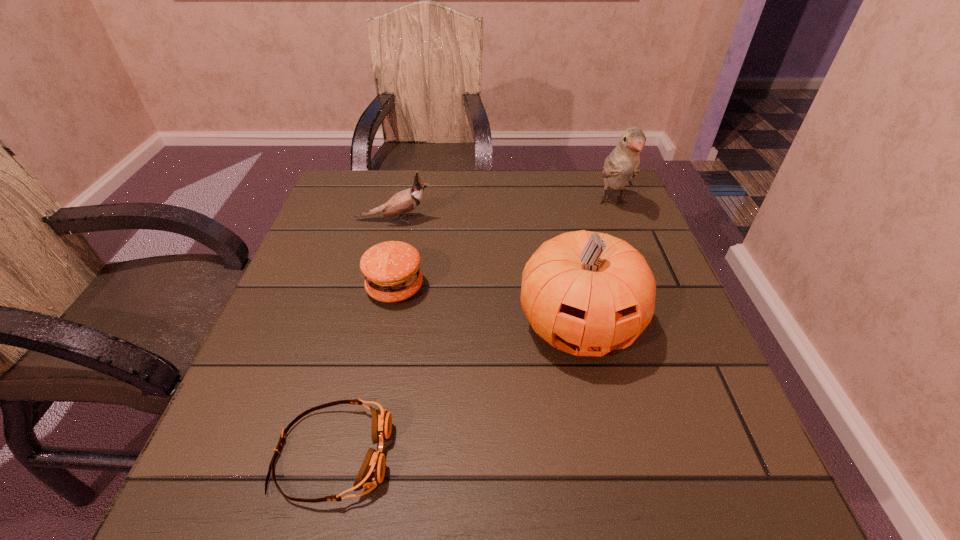
Image resolution: width=960 pixels, height=540 pixels. In order to click on vacant space that's between the fourth tallest object and the second object from right to left in this screenshot , I will do `click(487, 307)`.

Where is `vacant space in between the goggles and the rightmost object`? The height and width of the screenshot is (540, 960). vacant space in between the goggles and the rightmost object is located at coordinates click(x=472, y=328).

This screenshot has height=540, width=960. In order to click on vacant space that's between the rightmost object and the shortest object in this screenshot , I will do pyautogui.click(x=472, y=328).

Identify the location of object that is the second closest to the left bird. (586, 293).

Identify the location of object that stands as the third closest to the nearest object. (406, 201).

Find the location of a particular element. The height and width of the screenshot is (540, 960). vacant area in the image that satisfies the following two spatial constraints: 1. on the back side of the second shortest object; 2. at the face of the third tallest object is located at coordinates (409, 220).

You are a GUI agent. You are given a task and a screenshot of the screen. Output one action in this format:
    pyautogui.click(x=<x>, y=<y>)
    Task: Click on the vacant space that satisfies the following two spatial constraints: 1. on the front side of the fourth tallest object; 2. with the lenses facing forward on the shortest object
    The image size is (960, 540).
    Given the screenshot: What is the action you would take?
    pyautogui.click(x=362, y=454)

The height and width of the screenshot is (540, 960). Find the location of `free space that satisfies the following two spatial constraints: 1. at the face of the left bird; 2. on the back side of the patty`. free space that satisfies the following two spatial constraints: 1. at the face of the left bird; 2. on the back side of the patty is located at coordinates (378, 288).

The height and width of the screenshot is (540, 960). Find the location of `vacant position in the image that satisfies the following two spatial constraints: 1. at the face of the rightmost object; 2. with the lenses facing forward on the nearest object`. vacant position in the image that satisfies the following two spatial constraints: 1. at the face of the rightmost object; 2. with the lenses facing forward on the nearest object is located at coordinates (711, 454).

Where is `free point that satisfies the following two spatial constraints: 1. at the face of the left bird; 2. on the right side of the patty`? This screenshot has height=540, width=960. free point that satisfies the following two spatial constraints: 1. at the face of the left bird; 2. on the right side of the patty is located at coordinates (378, 288).